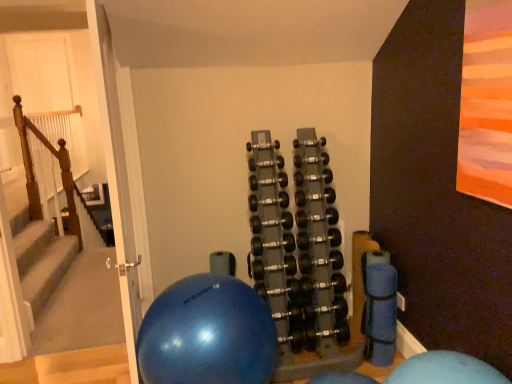
Locate an element on the screen. The image size is (512, 384). black rubber dumbbells at center is located at coordinates (298, 245).

This screenshot has width=512, height=384. In order to click on blue rubber ball at center in this screenshot , I will do `click(207, 334)`.

Where is `wooden at left`? wooden at left is located at coordinates (60, 174).

Is black rubber dumbbells at center taller or shorter than wooden at left?

black rubber dumbbells at center is shorter than wooden at left.

Considering the positions of objects black rubber dumbbells at center and wooden at left in the image provided, who is in front, black rubber dumbbells at center or wooden at left?

black rubber dumbbells at center.

Considering the positions of point (308, 158) and point (29, 131), is point (308, 158) closer or farther from the camera than point (29, 131)?

Point (308, 158) is positioned closer to the camera compared to point (29, 131).

Is wooden at left shorter than black rubber dumbbells at center?

Incorrect, the height of wooden at left does not fall short of that of black rubber dumbbells at center.

Is wooden at left positioned before black rubber dumbbells at center?

No, wooden at left is further to the viewer.

Is wooden at left far from black rubber dumbbells at center?

wooden at left is positioned a significant distance from black rubber dumbbells at center.

Is wooden at left aimed at black rubber dumbbells at center?

No.

Does blue rubber ball at center turn towards wooden at left?

No, blue rubber ball at center does not turn towards wooden at left.

In terms of width, does blue rubber ball at center look wider or thinner when compared to wooden at left?

blue rubber ball at center is wider than wooden at left.

Who is smaller, blue rubber ball at center or wooden at left?

With smaller size is wooden at left.

From the image's perspective, between blue rubber ball at center and black rubber dumbbells at center, which one is located above?

black rubber dumbbells at center appears higher in the image.

Does point (187, 363) come in front of point (297, 222)?

Yes, point (187, 363) is in front of point (297, 222).

Is blue rubber ball at center wider than black rubber dumbbells at center?

Yes.

Consider the image. Is blue rubber ball at center beside black rubber dumbbells at center?

No, blue rubber ball at center is not making contact with black rubber dumbbells at center.

Can you confirm if wooden at left is positioned to the left of blue rubber ball at center?

Indeed, wooden at left is positioned on the left side of blue rubber ball at center.

From the image's perspective, is wooden at left above or below blue rubber ball at center?

wooden at left is situated higher than blue rubber ball at center in the image.

Is wooden at left looking in the opposite direction of blue rubber ball at center?

No, wooden at left is not facing the opposite direction of blue rubber ball at center.

Is wooden at left taller or shorter than blue rubber ball at center?

In the image, wooden at left appears to be taller than blue rubber ball at center.

Find the location of a particular element. The height and width of the screenshot is (384, 512). dumbbell on the right of the blue rubber ball at center is located at coordinates (298, 245).

Is black rubber dumbbells at center in front of blue rubber ball at center?

No, the depth of black rubber dumbbells at center is greater than that of blue rubber ball at center.

Is black rubber dumbbells at center taller than blue rubber ball at center?

Yes.

Which of these two, black rubber dumbbells at center or blue rubber ball at center, is wider?

With larger width is blue rubber ball at center.

Image resolution: width=512 pixels, height=384 pixels. Find the location of `dumbbell that is under the wooden at left (from a real-world perspective)`. dumbbell that is under the wooden at left (from a real-world perspective) is located at coordinates (298, 245).

Where is `rail above the black rubber dumbbells at center (from a real-world perspective)`? rail above the black rubber dumbbells at center (from a real-world perspective) is located at coordinates (60, 174).

When comparing their distances from wooden at left, does blue rubber ball at center or black rubber dumbbells at center seem closer?

Based on the image, black rubber dumbbells at center appears to be nearer to wooden at left.

Based on their spatial positions, is wooden at left or black rubber dumbbells at center closer to blue rubber ball at center?

Based on the image, black rubber dumbbells at center appears to be nearer to blue rubber ball at center.

Looking at the image, which one is located further to black rubber dumbbells at center, wooden at left or blue rubber ball at center?

Based on the image, wooden at left appears to be further to black rubber dumbbells at center.

Based on the photo, looking at the image, which one is located further to wooden at left, black rubber dumbbells at center or blue rubber ball at center?

blue rubber ball at center lies further to wooden at left than the other object.

Estimate the real-world distances between objects in this image. Which object is further from black rubber dumbbells at center, blue rubber ball at center or wooden at left?

wooden at left.

Based on their spatial positions, is black rubber dumbbells at center or wooden at left closer to blue rubber ball at center?

black rubber dumbbells at center.

Locate an element on the screen. The height and width of the screenshot is (384, 512). dumbbell positioned between blue rubber ball at center and wooden at left from near to far is located at coordinates (298, 245).